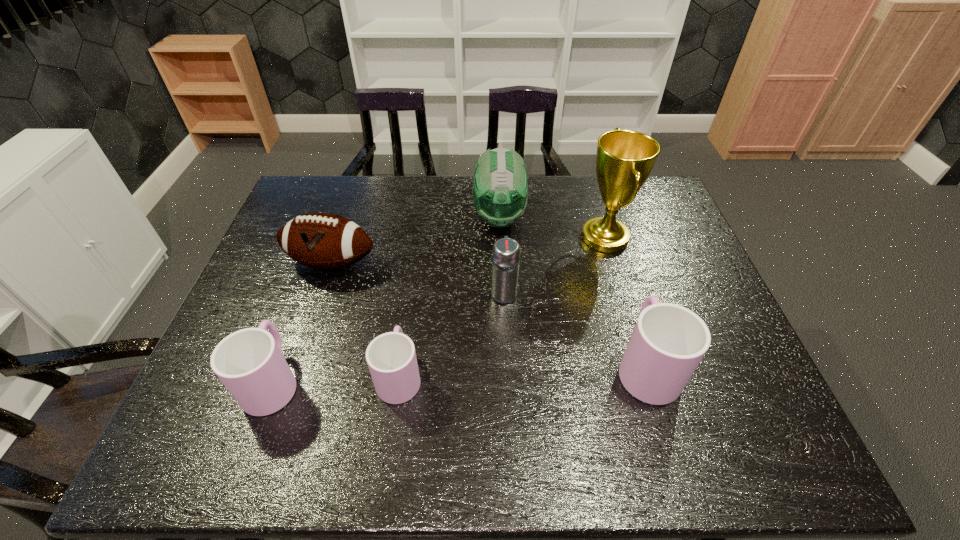
This screenshot has height=540, width=960. Identify the location of the leftmost cup. click(249, 362).

You are a GUI agent. You are given a task and a screenshot of the screen. Output one action in this format:
    pyautogui.click(x=<x>, y=<y>)
    Task: Click on the shortest object
    The width and height of the screenshot is (960, 540).
    Given the screenshot: What is the action you would take?
    pyautogui.click(x=391, y=357)

At what (x,y) coordinates should I click in order to perform the action: click on the third object from left to right. Please return your answer as a coordinate pair (x, y). Looking at the image, I should click on (391, 357).

The height and width of the screenshot is (540, 960). Identify the location of the rightmost cup. (668, 342).

Image resolution: width=960 pixels, height=540 pixels. What are the coordinates of `the sixth shortest object` in the screenshot? It's located at (500, 193).

You are a GUI agent. You are given a task and a screenshot of the screen. Output one action in this format:
    pyautogui.click(x=<x>, y=<y>)
    Task: Click on the tallest object
    This screenshot has width=960, height=540.
    Given the screenshot: What is the action you would take?
    pyautogui.click(x=625, y=158)

Locate an element on the screen. This screenshot has height=540, width=960. thermos bottle is located at coordinates (506, 252).

This screenshot has width=960, height=540. I want to click on football (American), so click(323, 241).

Find the location of a particular element. This screenshot has width=960, height=540. blank space located with the handle on the side of the leftmost cup is located at coordinates (291, 332).

You are a GUI agent. You are given a task and a screenshot of the screen. Output one action in this format:
    pyautogui.click(x=<x>, y=<y>)
    Task: Click on the vacant point located 0.270m with the handle on the side of the leftmost cup
    The width and height of the screenshot is (960, 540).
    Given the screenshot: What is the action you would take?
    pyautogui.click(x=314, y=269)